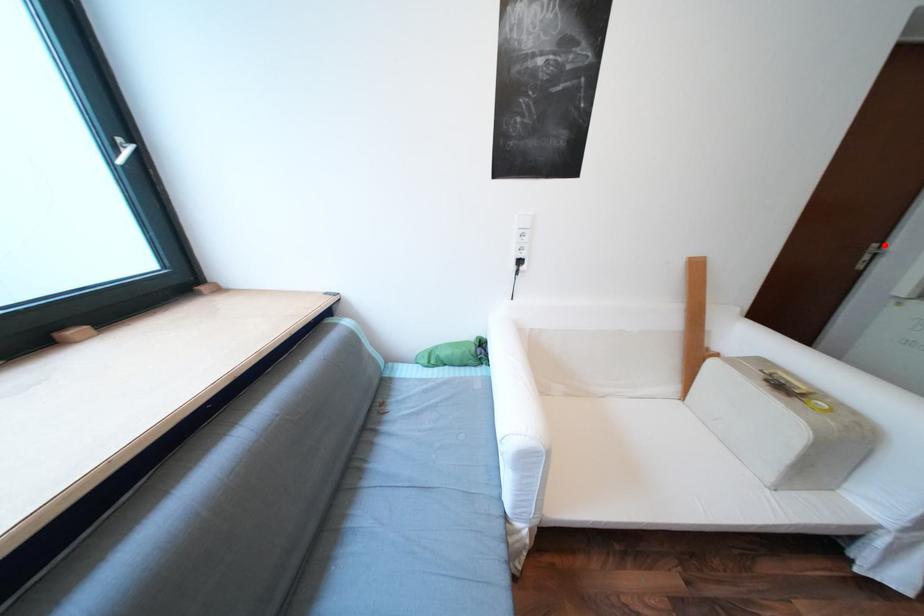
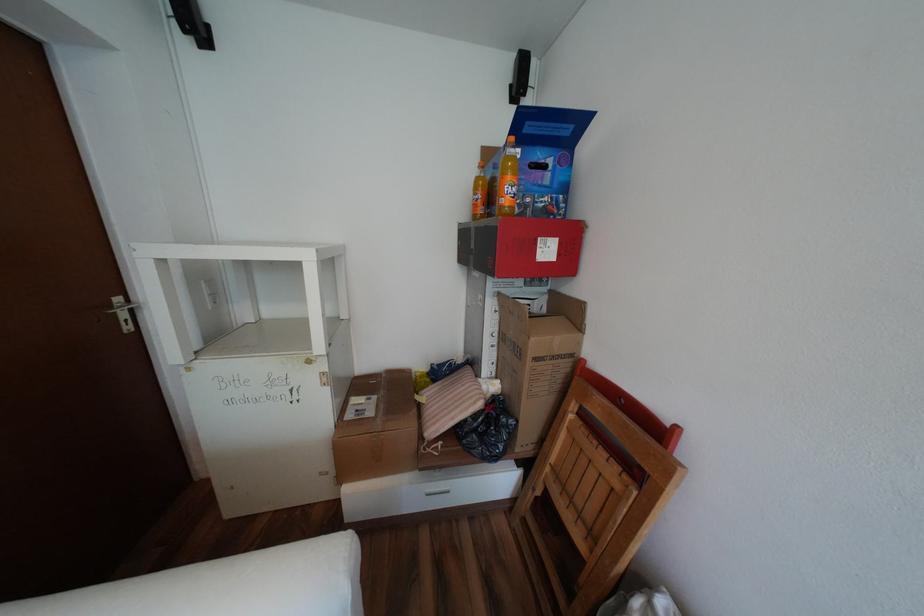
Question: A red point is marked in image1. In image2, is the corresponding 3D point closer to the camera or farther? Reply with the corresponding letter.

Choices:
 (A) The corresponding 3D point is closer.
 (B) The corresponding 3D point is farther.

Answer: (A)